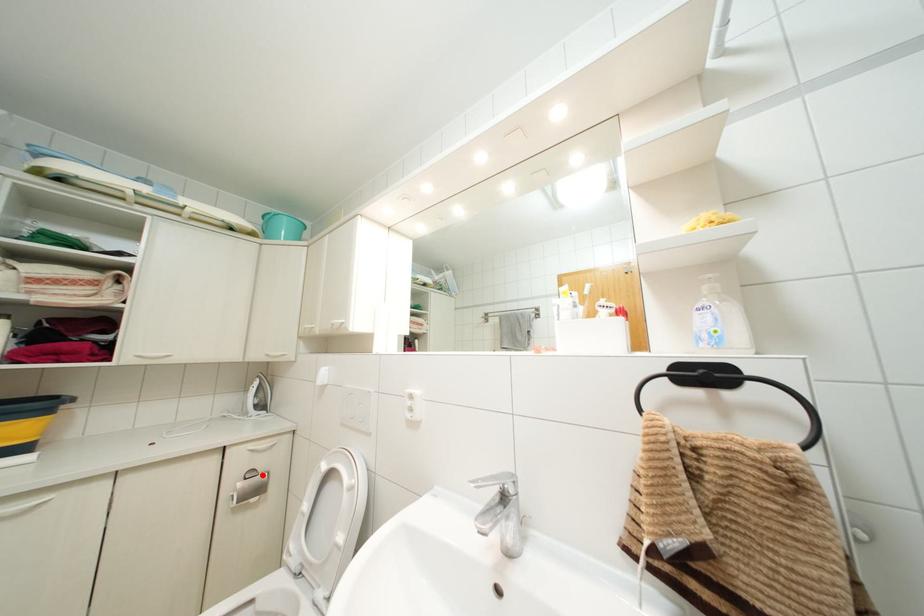
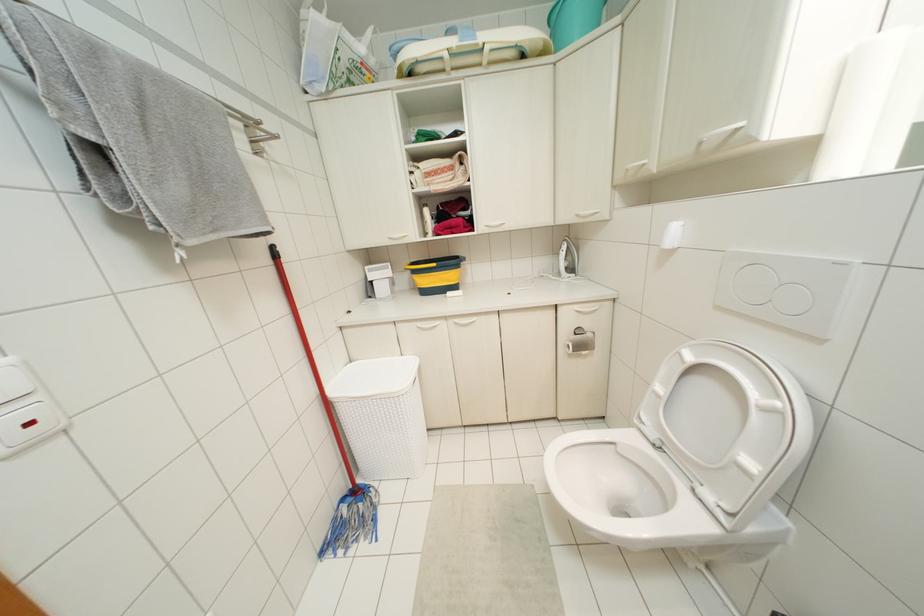
Question: I am providing you with two images of the same scene from different viewpoints. Image1 has a red point marked. In image2, the corresponding 3D location appears at what relative position? Reply with the corresponding letter.

Choices:
 (A) Closer
 (B) Farther

Answer: (A)